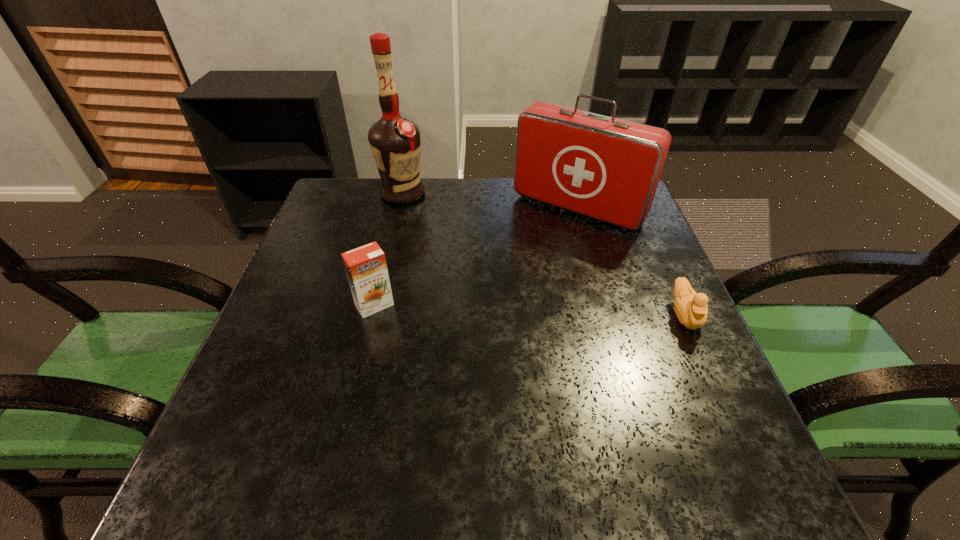
I want to click on free space on the desktop that is between the orange juice and the duckling and is positioned on the front and back of the liquor, so click(x=490, y=309).

Where is `free space on the desktop that is between the third tallest object and the shortest object and is positioned on the side of the first-aid kit with the first aid cross symbol`? The width and height of the screenshot is (960, 540). free space on the desktop that is between the third tallest object and the shortest object and is positioned on the side of the first-aid kit with the first aid cross symbol is located at coordinates (499, 309).